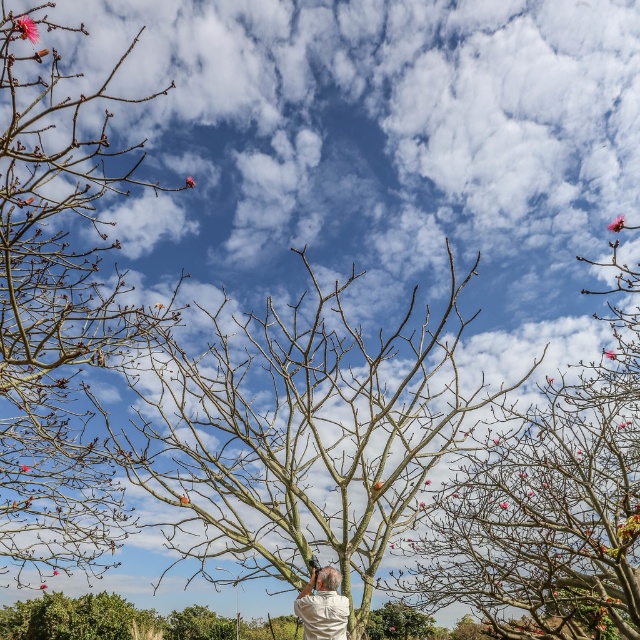
Question: Can you confirm if bare branches at upper right is positioned above white cotton shirt at center?

Choices:
 (A) no
 (B) yes

Answer: (B)

Question: Based on their relative distances, which object is farther from the bare branches at center?

Choices:
 (A) white cotton shirt at center
 (B) bare branches at upper right
 (C) bare branches at left

Answer: (B)

Question: Which point is closer to the camera?

Choices:
 (A) (259, 406)
 (B) (44, 13)
 (C) (298, 609)
 (D) (556, 616)

Answer: (B)

Question: Which of the following is the closest to the observer?

Choices:
 (A) (403, 385)
 (B) (316, 605)
 (C) (148, 326)
 (D) (560, 454)

Answer: (A)

Question: Can you confirm if bare branches at center is positioned to the right of white cotton shirt at center?

Choices:
 (A) no
 (B) yes

Answer: (A)

Question: Is bare branches at center positioned at the back of white cotton shirt at center?

Choices:
 (A) no
 (B) yes

Answer: (A)